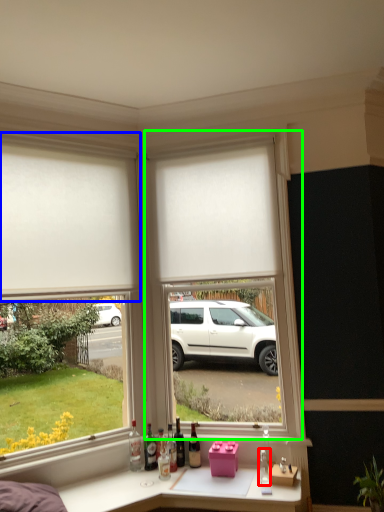
Question: Which object is the farthest from bottle (highlighted by a red box)? Choose among these: window (highlighted by a blue box) or window frame (highlighted by a green box).

Choices:
 (A) window
 (B) window frame

Answer: (A)